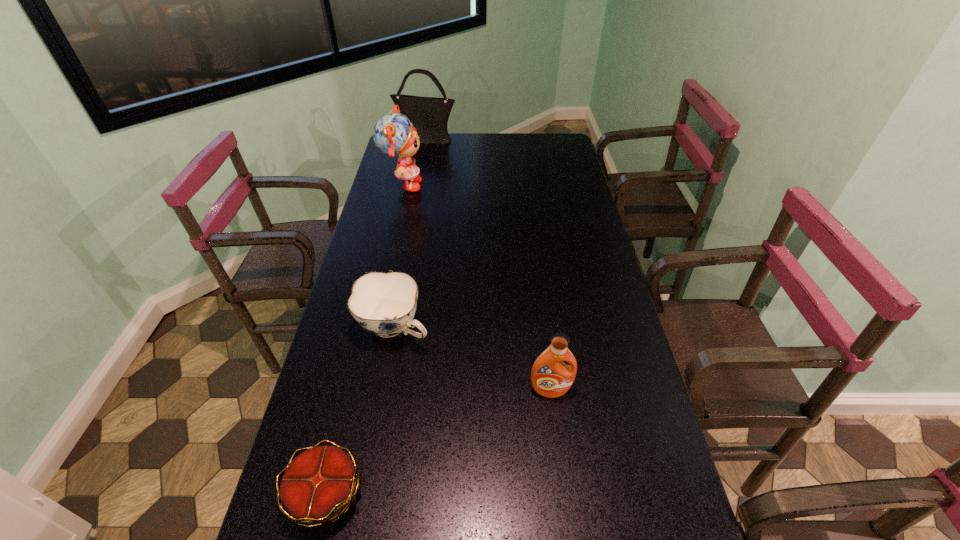
Where is `vacant region located 0.220m on the front-facing side of the fourth farthest object`? The width and height of the screenshot is (960, 540). vacant region located 0.220m on the front-facing side of the fourth farthest object is located at coordinates (564, 489).

Identify the location of vacant space located 0.370m on the back of the third farthest object. The width and height of the screenshot is (960, 540). (413, 227).

What are the coordinates of `free space located 0.130m on the back of the shortest object` in the screenshot? It's located at (348, 404).

Locate an element on the screen. The height and width of the screenshot is (540, 960). object at the far edge is located at coordinates (429, 115).

Where is `shoulder bag that is at the left edge`? shoulder bag that is at the left edge is located at coordinates tap(429, 115).

I want to click on doll present at the left edge, so click(x=393, y=134).

Locate an element on the screen. This screenshot has height=540, width=960. chinaware that is at the left edge is located at coordinates (384, 304).

The height and width of the screenshot is (540, 960). I want to click on crown located in the left edge section of the desktop, so click(318, 487).

Locate an element on the screen. The image size is (960, 540). object at the far left corner is located at coordinates (429, 115).

In the image, there is a desktop. Where is `blank space at the far edge`? The image size is (960, 540). blank space at the far edge is located at coordinates (499, 133).